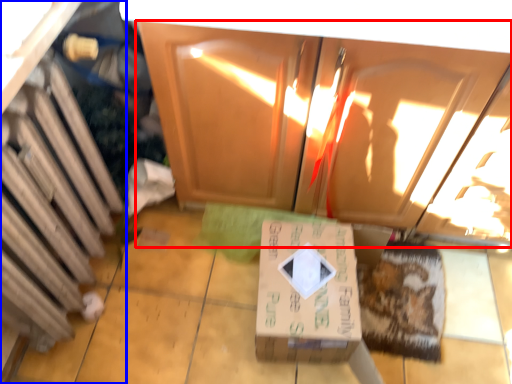
Question: Which object appears farthest to the camera in this image, cabinetry (highlighted by a red box) or cabinetry (highlighted by a blue box)?

Choices:
 (A) cabinetry
 (B) cabinetry

Answer: (A)